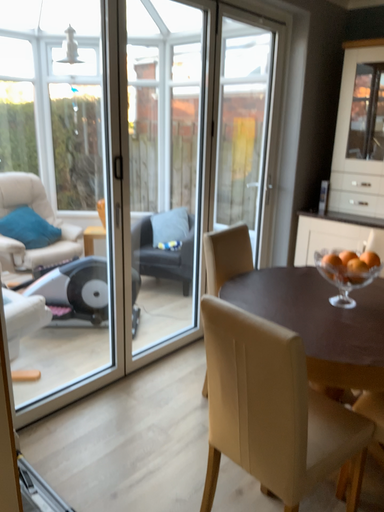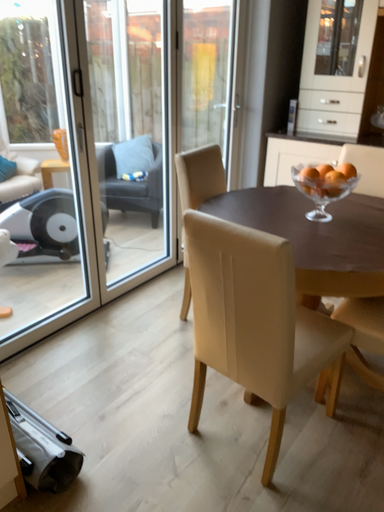
Question: How did the camera likely rotate when shooting the video?

Choices:
 (A) rotated upward
 (B) rotated downward

Answer: (B)